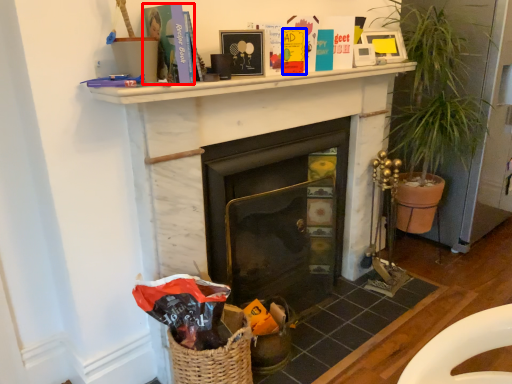
Question: Which object is closer to the camera taking this photo, paperback book (highlighted by a red box) or paperback book (highlighted by a blue box)?

Choices:
 (A) paperback book
 (B) paperback book

Answer: (A)